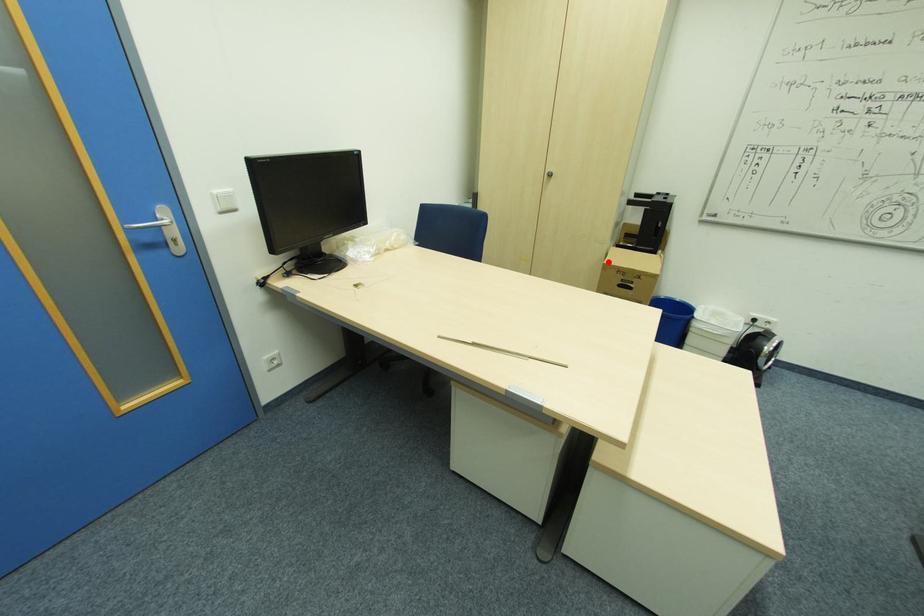
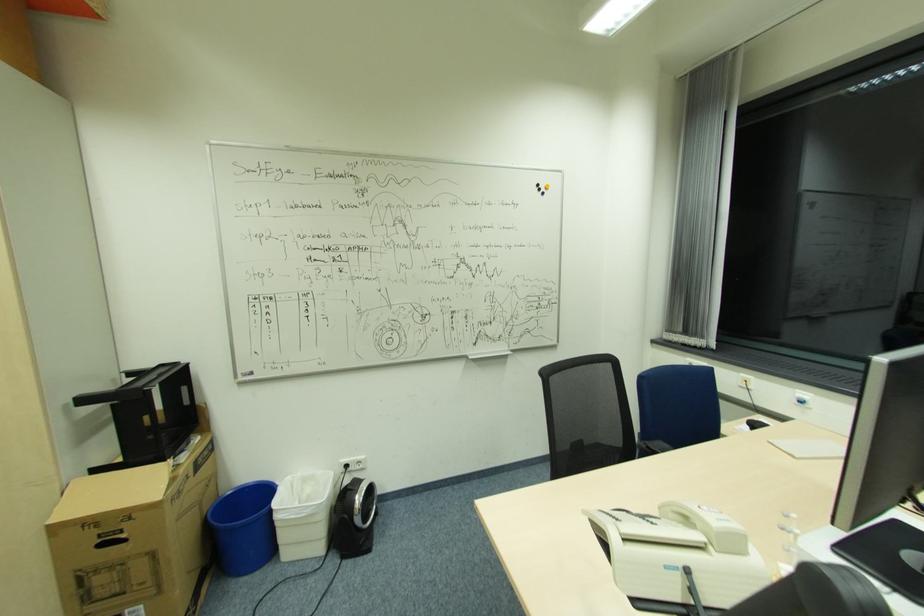
Question: I am providing you with two images of the same scene from different viewpoints. A red point is shown in image1. For the corresponding object point in image2, is it positioned nearer or farther from the camera?

Choices:
 (A) Nearer
 (B) Farther

Answer: (A)